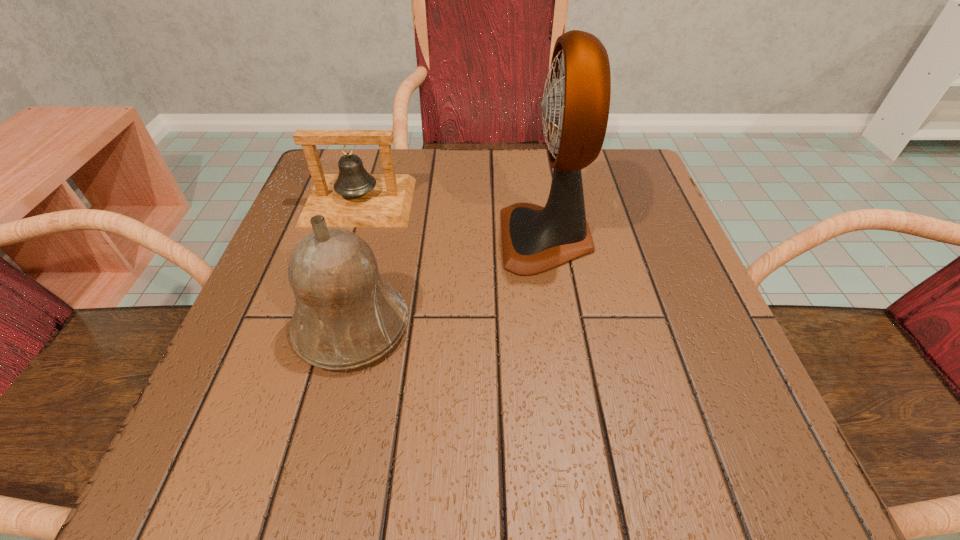
Where is `vacant space that satisfies the following two spatial constraints: 1. on the front side of the nearer bell; 2. on the left side of the shorter bell`? The image size is (960, 540). vacant space that satisfies the following two spatial constraints: 1. on the front side of the nearer bell; 2. on the left side of the shorter bell is located at coordinates (320, 326).